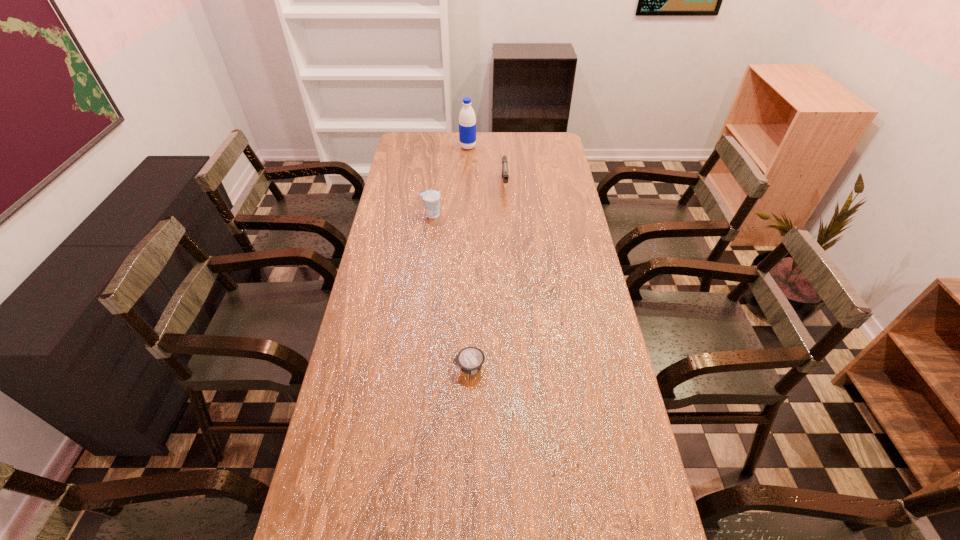
Find the location of a particular element. Image resolution: width=960 pixels, height=540 pixels. vacant region located 0.190m on the front of the taller yogurt is located at coordinates (426, 255).

Identify the location of vacant space located on the back of the shorter yogurt. (471, 265).

I want to click on object located in the far edge section of the desktop, so click(x=467, y=121).

Where is `object at the left edge`? object at the left edge is located at coordinates point(431,198).

What are the coordinates of `vacant space at the far edge of the desktop` in the screenshot? It's located at pos(444,132).

Find the location of a particular element. This screenshot has width=960, height=540. vacant space at the left edge is located at coordinates (429, 181).

Find the location of a particular element. vacant region at the right edge of the desktop is located at coordinates (576, 349).

I want to click on free space at the far left corner, so click(416, 136).

Identify the location of free point between the farthest object and the shorter yogurt. This screenshot has width=960, height=540. 468,257.

You are a GUI agent. You are given a task and a screenshot of the screen. Output one action in this format:
    pyautogui.click(x=<x>, y=<y>)
    Task: Click on the free spot between the gun and the leftmost object
    
    Given the screenshot: What is the action you would take?
    pyautogui.click(x=468, y=199)